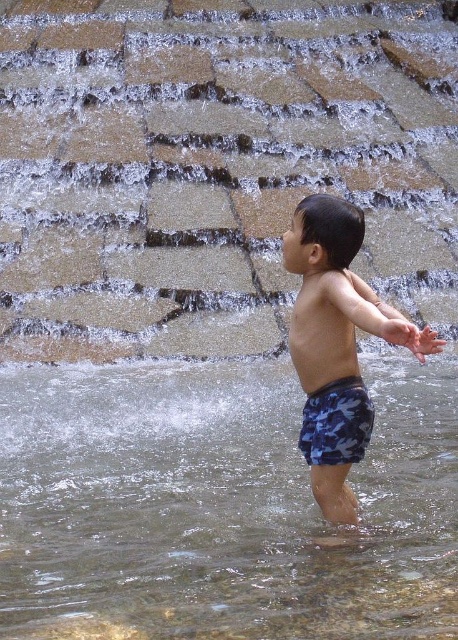
Question: Which object appears farthest from the camera in this image?

Choices:
 (A) clear water at lower center
 (B) camouflage shorts at center
 (C) blue camouflage shorts at center
 (D) camouflage fabric shorts at center

Answer: (B)

Question: Which of the following is the farthest from the observer?

Choices:
 (A) (348, 387)
 (B) (1, 401)
 (C) (316, 285)
 (D) (316, 397)

Answer: (B)

Question: Can you confirm if clear water at lower center is positioned above blue camouflage shorts at center?

Choices:
 (A) yes
 (B) no

Answer: (B)

Question: Can you confirm if clear water at lower center is bigger than camouflage fabric shorts at center?

Choices:
 (A) yes
 (B) no

Answer: (A)

Question: Which point is farther to the camera?

Choices:
 (A) pyautogui.click(x=316, y=369)
 (B) pyautogui.click(x=355, y=214)
 (C) pyautogui.click(x=230, y=618)

Answer: (A)

Question: Can you confirm if camouflage shorts at center is positioned below camouflage fabric shorts at center?

Choices:
 (A) no
 (B) yes

Answer: (A)